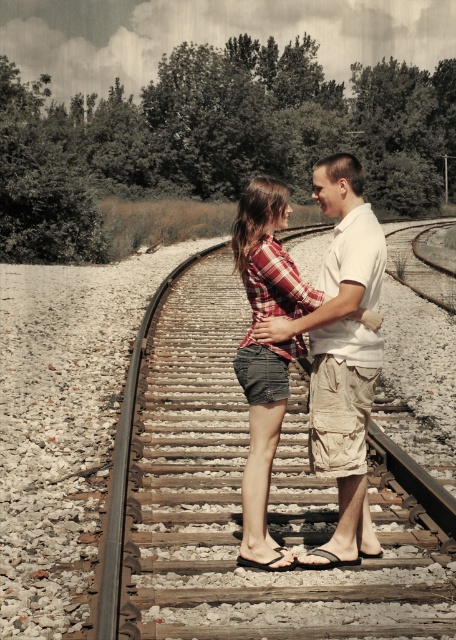
You are a photographer trying to capture a candid shot of the couple standing on the railway track. You notice the white cotton shirt at center and the plaid fabric shorts at center. Which clothing item is positioned to the right side of the other?

The white cotton shirt at center is to the right of the plaid fabric shorts at center.

In the scene shown: You are a photographer trying to capture the couple in the scene. Since the white cotton shirt at center and plaid fabric shorts at center are both at the center, which one will appear more prominent in the photo?

The white cotton shirt at center is larger in size than plaid fabric shorts at center, so the white cotton shirt at center will appear more prominent in the photo.